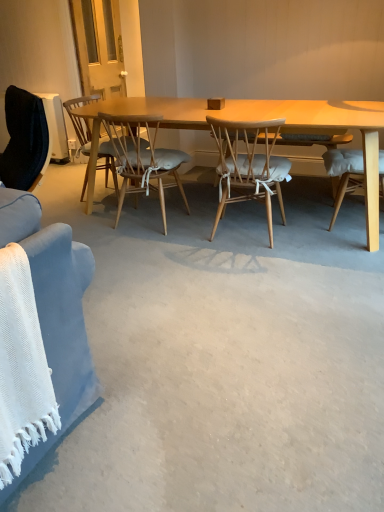
Question: Visually, is wooden chair with cushion at center, which ranks as the 1th chair in left-to-right order, positioned to the left or to the right of light brown wood chair at center, which ranks as the 2th chair in left-to-right order?

Choices:
 (A) left
 (B) right

Answer: (A)

Question: Is wooden chair with cushion at center, acting as the 3th chair starting from the right, situated inside light brown wood chair at center, which ranks as the 2th chair in left-to-right order, or outside?

Choices:
 (A) outside
 (B) inside

Answer: (A)

Question: Which of these objects is positioned farthest from the light brown wood chair at center, which ranks as the 2th chair in left-to-right order?

Choices:
 (A) light brown woven wood chair at center, the first chair positioned from the right
 (B) wooden chair with cushion at center, which ranks as the 1th chair in left-to-right order

Answer: (A)

Question: Estimate the real-world distances between objects in this image. Which object is closer to the light brown wood chair at center, the second chair in the right-to-left sequence?

Choices:
 (A) light brown woven wood chair at center, placed as the 3th chair when sorted from left to right
 (B) wooden chair with cushion at center, which ranks as the 1th chair in left-to-right order

Answer: (B)